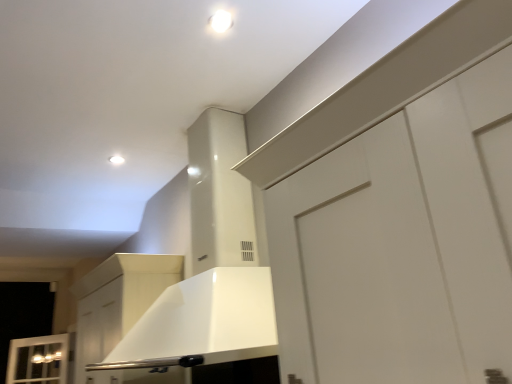
Question: In which direction should I rotate to look at white glossy light fixture at upper center, the 2th lighting when ordered from left to right?

Choices:
 (A) left
 (B) right

Answer: (A)

Question: Is white glossy light fixture at upper center, the 1th lighting from the top, oriented towards white glossy light fixture at upper center, the second lighting positioned from the top?

Choices:
 (A) no
 (B) yes

Answer: (A)

Question: Can you confirm if white glossy light fixture at upper center, which appears as the first lighting when viewed from the right, is smaller than white glossy light fixture at upper center, the 1th lighting from the left?

Choices:
 (A) no
 (B) yes

Answer: (A)

Question: Is white glossy light fixture at upper center, which is counted as the 1th lighting, starting from the front, positioned beyond the bounds of white glossy light fixture at upper center, which is the second lighting in right-to-left order?

Choices:
 (A) yes
 (B) no

Answer: (A)

Question: Is white glossy light fixture at upper center, acting as the second lighting starting from the bottom, far away from white glossy light fixture at upper center, acting as the first lighting starting from the back?

Choices:
 (A) yes
 (B) no

Answer: (A)

Question: From a real-world perspective, is white glossy light fixture at upper center, which is counted as the second lighting, starting from the back, below white glossy light fixture at upper center, which is the second lighting in right-to-left order?

Choices:
 (A) no
 (B) yes

Answer: (A)

Question: Is white glossy light fixture at upper center, acting as the second lighting starting from the bottom, bigger than white glossy light fixture at upper center, placed as the 2th lighting when sorted from front to back?

Choices:
 (A) yes
 (B) no

Answer: (A)

Question: Are white glossy light fixture at upper center, the 1th lighting positioned from the bottom, and white matte cabinet at center located far from each other?

Choices:
 (A) yes
 (B) no

Answer: (B)

Question: Is white glossy light fixture at upper center, which is the second lighting in right-to-left order, at the left side of white matte cabinet at center?

Choices:
 (A) no
 (B) yes

Answer: (A)

Question: From a real-world perspective, is white glossy light fixture at upper center, acting as the first lighting starting from the back, over white matte cabinet at center?

Choices:
 (A) yes
 (B) no

Answer: (A)

Question: From the image's perspective, is white glossy light fixture at upper center, the second lighting positioned from the top, located beneath white matte cabinet at center?

Choices:
 (A) no
 (B) yes

Answer: (A)

Question: Considering the relative sizes of white glossy light fixture at upper center, which is the second lighting in right-to-left order, and white matte cabinet at center in the image provided, is white glossy light fixture at upper center, which is the second lighting in right-to-left order, thinner than white matte cabinet at center?

Choices:
 (A) yes
 (B) no

Answer: (A)

Question: Is white matte cabinet at center at the back of white glossy light fixture at upper center, placed as the 2th lighting when sorted from front to back?

Choices:
 (A) yes
 (B) no

Answer: (B)

Question: Considering the relative sizes of white matte cabinet at center and white glossy light fixture at upper center, which appears as the first lighting when viewed from the right, in the image provided, is white matte cabinet at center bigger than white glossy light fixture at upper center, which appears as the first lighting when viewed from the right,?

Choices:
 (A) yes
 (B) no

Answer: (A)